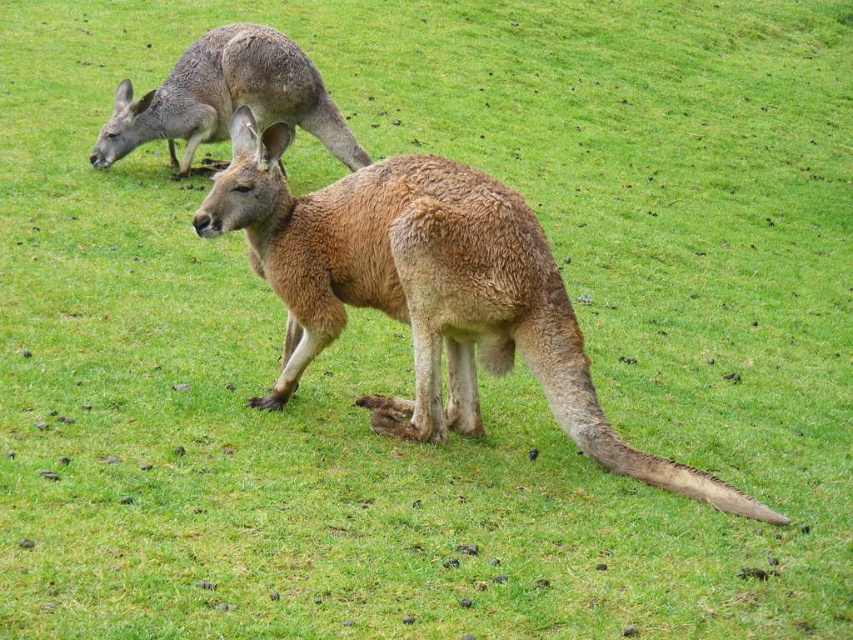
Which of these two, brown furry kangaroo at center or gray fur kangaroo at upper left, stands taller?

brown furry kangaroo at center

Describe the element at coordinates (427, 292) in the screenshot. This screenshot has width=853, height=640. I see `brown furry kangaroo at center` at that location.

At what (x,y) coordinates should I click in order to perform the action: click on brown furry kangaroo at center. Please return your answer as a coordinate pair (x, y). The image size is (853, 640). Looking at the image, I should click on (427, 292).